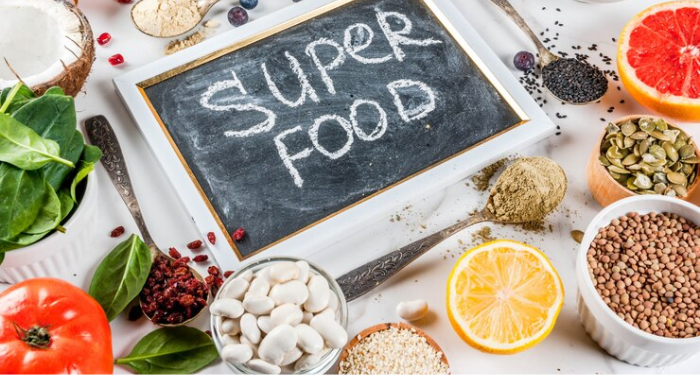
The image size is (700, 375). I want to click on table cloth, so click(427, 266).